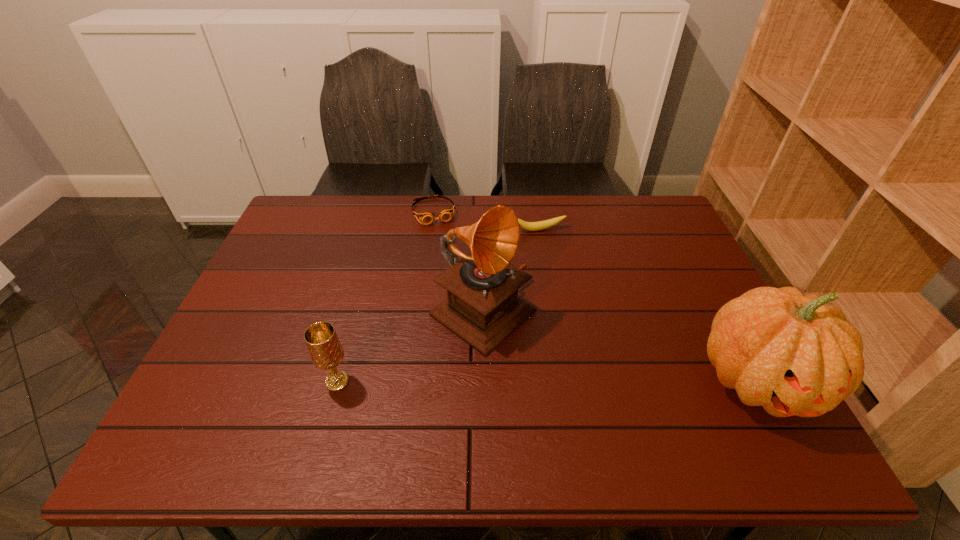
Locate an element on the screen. The height and width of the screenshot is (540, 960). blank space located 0.060m on the horn of the tallest object is located at coordinates (544, 355).

You are a GUI agent. You are given a task and a screenshot of the screen. Output one action in this format:
    pyautogui.click(x=<x>, y=<y>)
    Task: Click on the free location located on the upward curve of the banana
    
    Given the screenshot: What is the action you would take?
    pyautogui.click(x=559, y=265)

You are a GUI agent. You are given a task and a screenshot of the screen. Output one action in this format:
    pyautogui.click(x=<x>, y=<y>)
    Task: Click on the free spot located on the upward curve of the banana
    The image size is (960, 540).
    Given the screenshot: What is the action you would take?
    pyautogui.click(x=572, y=293)

At what (x,y) coordinates should I click in order to perform the action: click on free space located on the upward curve of the banana. Please return your answer as a coordinate pair (x, y). This screenshot has height=540, width=960. Looking at the image, I should click on (561, 269).

You are a GUI agent. You are given a task and a screenshot of the screen. Output one action in this format:
    pyautogui.click(x=<x>, y=<y>)
    Task: Click on the vacant space located 0.370m with the lenses facing forward on the shortest object
    This screenshot has height=540, width=960.
    Given the screenshot: What is the action you would take?
    pyautogui.click(x=464, y=308)

This screenshot has width=960, height=540. I want to click on free point located with the lenses facing forward on the shortest object, so click(459, 294).

The height and width of the screenshot is (540, 960). I want to click on vacant position located with the lenses facing forward on the shortest object, so click(x=464, y=308).

Identify the location of banana positioned at the far edge. (540, 225).

The image size is (960, 540). I want to click on goggles that is positioned at the far edge, so click(x=426, y=217).

You are a GUI agent. You are given a task and a screenshot of the screen. Output one action in this format:
    pyautogui.click(x=<x>, y=<y>)
    Task: Click on the chalice at the near edge
    
    Given the screenshot: What is the action you would take?
    pyautogui.click(x=326, y=352)